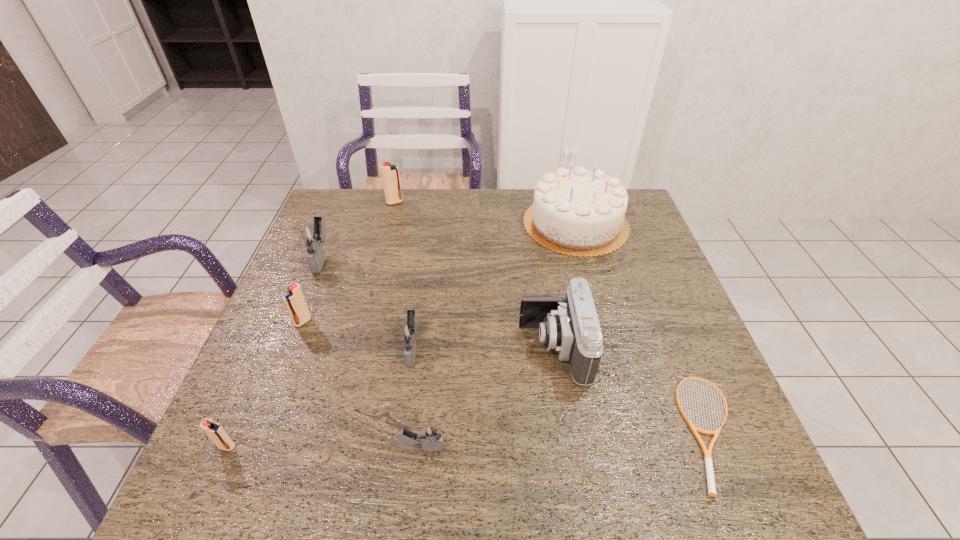
Image resolution: width=960 pixels, height=540 pixels. Identify the location of empty space between the camera and the second biggest gray igniter. (484, 348).

This screenshot has height=540, width=960. What are the coordinates of `free spot between the camera and the nearest gray igniter` in the screenshot? It's located at (x=488, y=398).

Identify the location of vacant area that lies between the fourth nearest igniter and the farthest red igniter. The height and width of the screenshot is (540, 960). (348, 262).

I want to click on vacant point located between the fourth object from left to right and the second farthest gray igniter, so click(404, 275).

The width and height of the screenshot is (960, 540). I want to click on free area in between the farthest gray igniter and the camera, so click(x=439, y=303).

Where is `unoccupied area between the fourth nearest igniter and the fourth farthest igniter`? The image size is (960, 540). unoccupied area between the fourth nearest igniter and the fourth farthest igniter is located at coordinates (358, 335).

The height and width of the screenshot is (540, 960). What are the coordinates of `vacant area between the camera and the second biggest gray igniter` in the screenshot? It's located at (484, 348).

You are a GUI agent. You are given a task and a screenshot of the screen. Output one action in this format:
    pyautogui.click(x=<x>, y=<y>)
    Task: Click on the object identified as the fifth closest to the shortest object
    The height and width of the screenshot is (540, 960).
    Given the screenshot: What is the action you would take?
    pyautogui.click(x=294, y=300)

Where is `object that is the third closest to the nearest gray igniter`? Image resolution: width=960 pixels, height=540 pixels. object that is the third closest to the nearest gray igniter is located at coordinates (215, 431).

Select which igniter is the third closest to the camera. Please provide its 2D coordinates. Your answer should be formatted as a tuple, i.e. [(x, y)], where the tuple contains the x and y coordinates of a point satisfying the conditions above.

[(294, 300)]